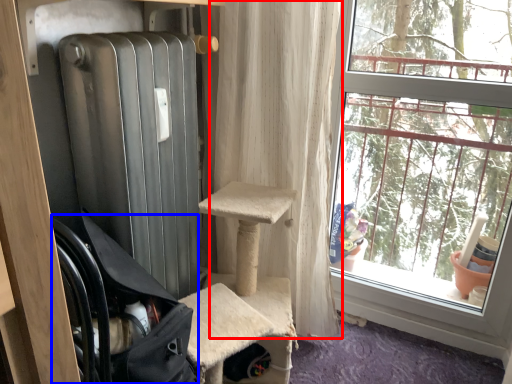
Question: Which of the following is the farthest to the observer, curtain (highlighted by a red box) or chair (highlighted by a blue box)?

Choices:
 (A) curtain
 (B) chair

Answer: (A)